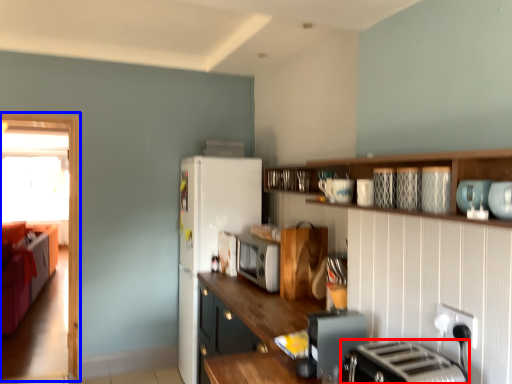
Question: Among these objects, which one is nearest to the camera, toaster (highlighted by a red box) or glass door (highlighted by a blue box)?

Choices:
 (A) toaster
 (B) glass door

Answer: (A)